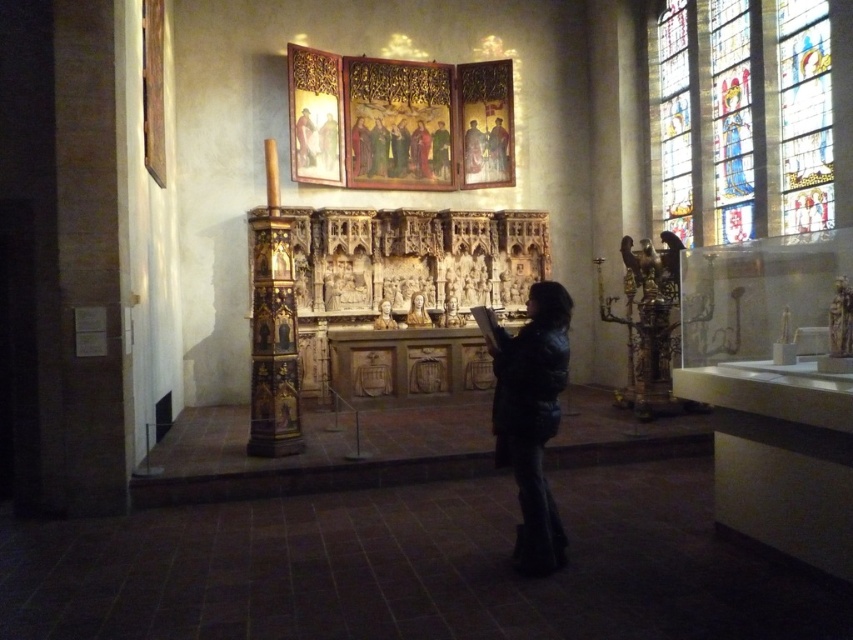
Is black leather jacket at center further to the viewer compared to matte wood painting at upper center?

No, black leather jacket at center is in front of matte wood painting at upper center.

Which is in front, point (548, 353) or point (474, 145)?

Point (548, 353) is in front.

The image size is (853, 640). In order to click on black leather jacket at center in this screenshot , I will do `click(532, 419)`.

Which is behind, point (766, 189) or point (518, 540)?

Point (766, 189)

The image size is (853, 640). Describe the element at coordinates (749, 116) in the screenshot. I see `stained glass window at upper right` at that location.

Between point (751, 80) and point (553, 518), which one is positioned in front?

Point (553, 518) is more forward.

Where is `stained glass window at upper right`? stained glass window at upper right is located at coordinates (749, 116).

What do you see at coordinates (532, 419) in the screenshot? This screenshot has height=640, width=853. I see `black leather jacket at center` at bounding box center [532, 419].

Can you confirm if black leather jacket at center is positioned above wooden statue at center?

No, black leather jacket at center is not above wooden statue at center.

Does point (511, 401) lie behind point (500, 148)?

No, (511, 401) is in front of (500, 148).

Where is `black leather jacket at center`? The width and height of the screenshot is (853, 640). black leather jacket at center is located at coordinates (532, 419).